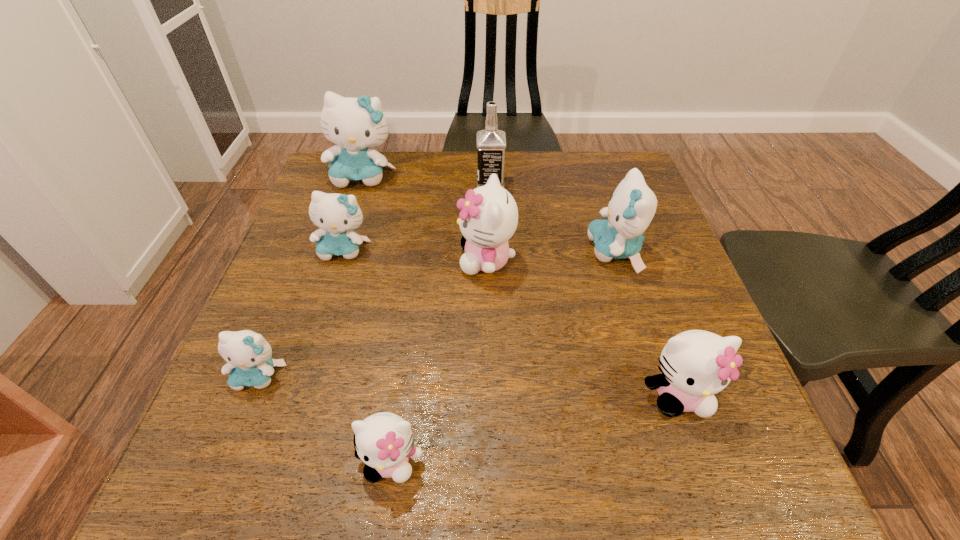
In the image, there is a desktop. Where is `vacant space at the near edge`? Image resolution: width=960 pixels, height=540 pixels. vacant space at the near edge is located at coordinates (658, 442).

Locate an element on the screen. Image resolution: width=960 pixels, height=540 pixels. free space at the right edge is located at coordinates (652, 338).

The height and width of the screenshot is (540, 960). In order to click on vacant region at the near left corner in this screenshot , I will do `click(224, 455)`.

Locate an element on the screen. The image size is (960, 540). free space at the far right corner is located at coordinates (608, 171).

What are the coordinates of `free space between the smallest blue kitten and the farthest blue kitten` in the screenshot? It's located at (311, 276).

At what (x,y) coordinates should I click in order to perform the action: click on unoccupied area between the nearest white kitten and the smallest blue kitten. Please return your answer as a coordinate pair (x, y). The width and height of the screenshot is (960, 540). Looking at the image, I should click on (324, 418).

You are a GUI agent. You are given a task and a screenshot of the screen. Output one action in this format:
    pyautogui.click(x=<x>, y=<y>)
    Task: Click on the free space between the biggest blue kitten and the vodka
    This screenshot has width=960, height=540.
    Given the screenshot: What is the action you would take?
    pyautogui.click(x=426, y=180)

At what (x,y) coordinates should I click in order to perform the action: click on vacant space in between the tallest kitten and the vodka. Please return your answer as a coordinate pair (x, y). The image size is (960, 540). Looking at the image, I should click on (426, 180).

Find the location of `vacant space that is in between the vodka and the rightmost blue kitten`. vacant space that is in between the vodka and the rightmost blue kitten is located at coordinates (553, 218).

Where is `vacant region between the nearest blue kitten and the rightmost white kitten`? The height and width of the screenshot is (540, 960). vacant region between the nearest blue kitten and the rightmost white kitten is located at coordinates (468, 386).